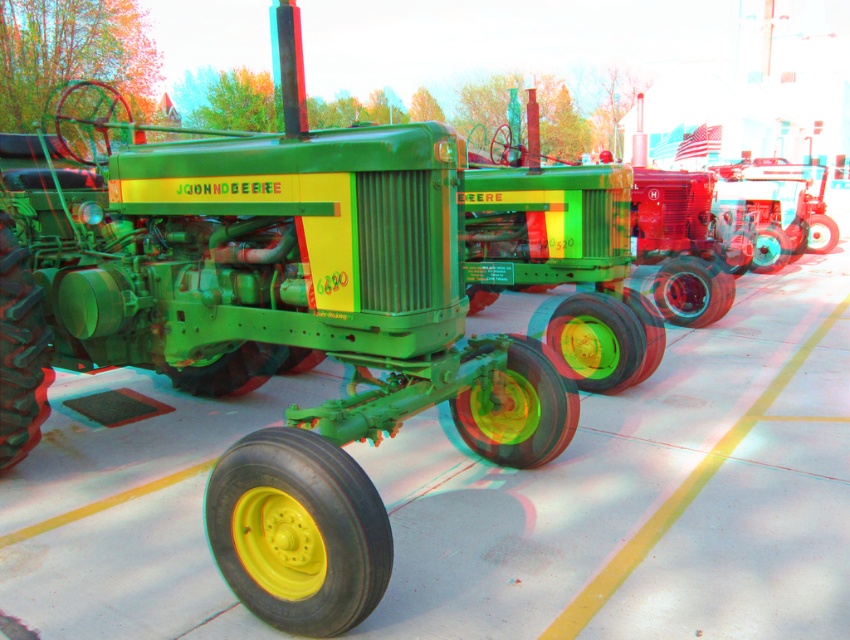
You are standing in front of the lineup of vintage tractors at the fair. You see the green matte tractor at center. Where exactly is it positioned in relation to the other tractors?

The green matte tractor at center is located at point 0.494 along the horizontal axis and 0.312 along the vertical axis, placing it centrally within the lineup.

You are a farmer inspecting the vintage tractors at the fair. You notice the green matte tractor at center and the yellow rubber tire at center. Which object is taller?

The green matte tractor at center is not as tall as the yellow rubber tire at center, so the yellow rubber tire at center is taller.

You are a photographer standing in front of the green matte tractor at center and the yellow rubber tire at center. You want to take a photo that captures both objects clearly. Which object should you focus on first to ensure both are in focus?

You should focus on the green matte tractor at center first because it is closer to you than the yellow rubber tire at center, so focusing on the closer object will help both be in focus.